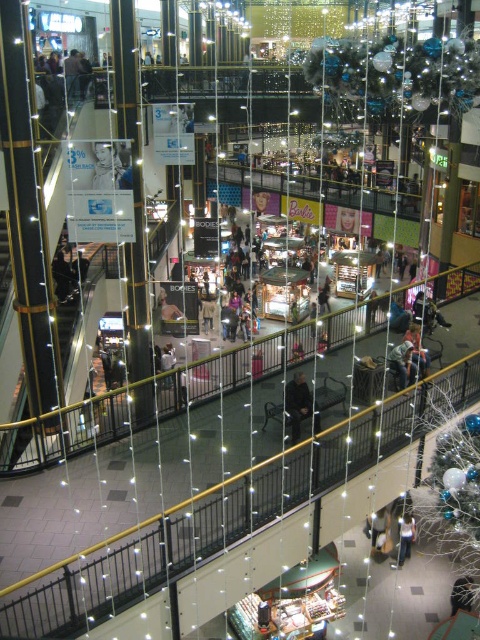
You are a store manager who wants to place a 1.2 meter wide display stand between the dark gray jacket at center and the light blue denim jeans at lower center. Can you fit it there?

The dark gray jacket at center is wider than the light blue denim jeans at lower center. Therefore, the 1.2 meter wide display stand may not fit between them if the space between the two is narrower than 1.2 meters. However, the exact distance isn

Based on the photo, you are a store manager who wants to place a large holiday decoration between the dark gray jacket at center and the light blue denim jeans at lower center. Which object should you place the decoration next to to ensure it doesn not block the smaller item?

The dark gray jacket at center is bigger than the light blue denim jeans at lower center, so placing the decoration next to the light blue denim jeans at lower center would prevent blocking the smaller item.